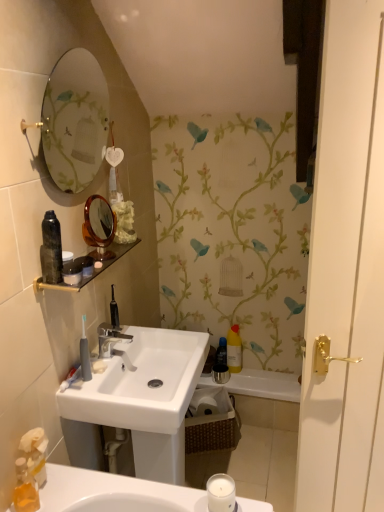
Question: Considering the relative sizes of gray rubber toothbrush at lower left, arranged as the second toiletry when ordered from the bottom, and silver metallic faucet at center in the image provided, is gray rubber toothbrush at lower left, arranged as the second toiletry when ordered from the bottom, wider than silver metallic faucet at center?

Choices:
 (A) yes
 (B) no

Answer: (B)

Question: From a real-world perspective, is gray rubber toothbrush at lower left, which is the first toiletry from top to bottom, physically below silver metallic faucet at center?

Choices:
 (A) yes
 (B) no

Answer: (B)

Question: From the image's perspective, does gray rubber toothbrush at lower left, marked as the 1th toiletry in a left-to-right arrangement, appear higher than silver metallic faucet at center?

Choices:
 (A) no
 (B) yes

Answer: (B)

Question: Could you tell me if gray rubber toothbrush at lower left, arranged as the second toiletry when ordered from the bottom, is facing silver metallic faucet at center?

Choices:
 (A) yes
 (B) no

Answer: (A)

Question: Considering the relative positions of gray rubber toothbrush at lower left, marked as the first toiletry in a front-to-back arrangement, and silver metallic faucet at center in the image provided, is gray rubber toothbrush at lower left, marked as the first toiletry in a front-to-back arrangement, to the right of silver metallic faucet at center from the viewer's perspective?

Choices:
 (A) no
 (B) yes

Answer: (A)

Question: From a real-world perspective, is silver metallic faucet at center physically located above or below translucent plastic soap dispenser at lower left?

Choices:
 (A) above
 (B) below

Answer: (A)

Question: Is silver metallic faucet at center situated inside translucent plastic soap dispenser at lower left or outside?

Choices:
 (A) outside
 (B) inside

Answer: (A)

Question: Based on their sizes in the image, would you say silver metallic faucet at center is bigger or smaller than translucent plastic soap dispenser at lower left?

Choices:
 (A) small
 (B) big

Answer: (B)

Question: From the image's perspective, is silver metallic faucet at center above or below translucent plastic soap dispenser at lower left?

Choices:
 (A) above
 (B) below

Answer: (A)

Question: In the image, is translucent plastic soap dispenser at lower left positioned in front of or behind white matte candle at lower center?

Choices:
 (A) front
 (B) behind

Answer: (A)

Question: From a real-world perspective, is translucent plastic soap dispenser at lower left above or below white matte candle at lower center?

Choices:
 (A) above
 (B) below

Answer: (A)

Question: Based on their positions, is translucent plastic soap dispenser at lower left located to the left or right of white matte candle at lower center?

Choices:
 (A) right
 (B) left

Answer: (B)

Question: In terms of height, does translucent plastic soap dispenser at lower left look taller or shorter compared to white matte candle at lower center?

Choices:
 (A) tall
 (B) short

Answer: (A)

Question: In the image, is silver metallic faucet at center on the left side or the right side of white glossy bathtub at center?

Choices:
 (A) right
 (B) left

Answer: (B)

Question: Is silver metallic faucet at center spatially inside white glossy bathtub at center, or outside of it?

Choices:
 (A) inside
 (B) outside

Answer: (B)